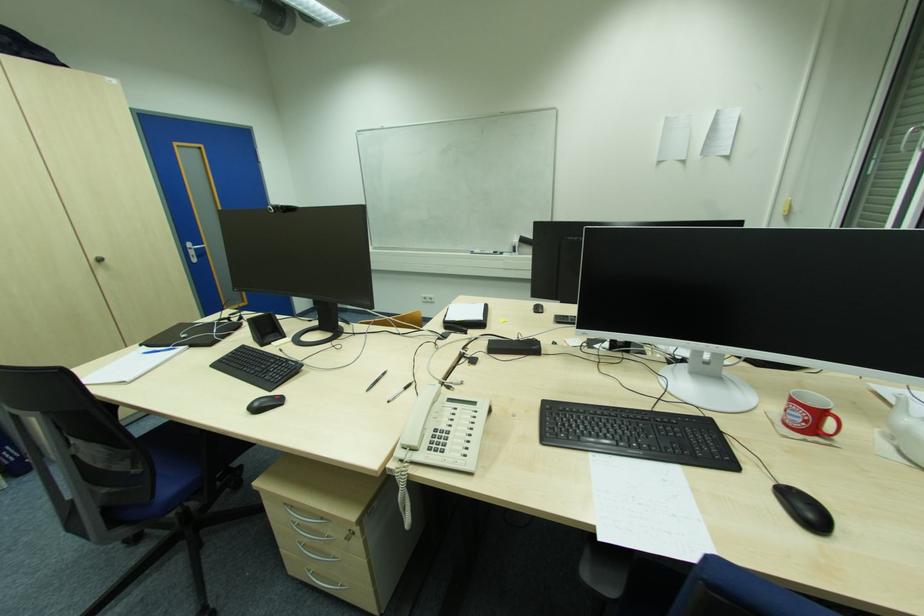
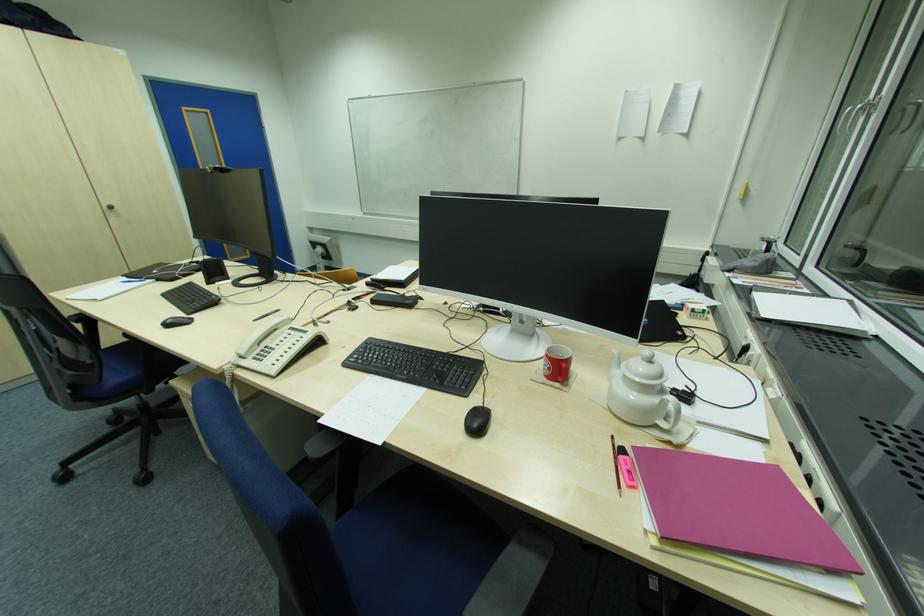
In the second image, find the point that corresponds to point (807, 422) in the first image.

(551, 370)